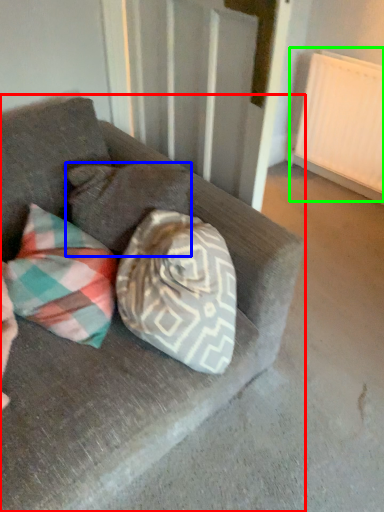
Question: Based on their relative distances, which object is nearer to studio couch (highlighted by a red box)? Choose from pillow (highlighted by a blue box) and radiator (highlighted by a green box).

Choices:
 (A) pillow
 (B) radiator

Answer: (A)